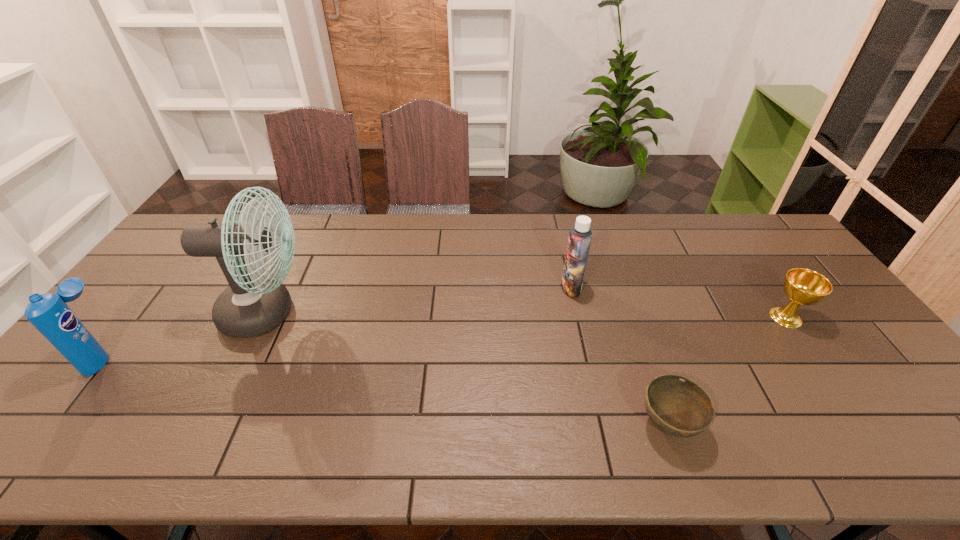
This screenshot has width=960, height=540. Find the location of `vacant area that lies between the fan and the chalice`. vacant area that lies between the fan and the chalice is located at coordinates (526, 315).

This screenshot has width=960, height=540. I want to click on empty space that is in between the third object from left to right and the nearest object, so click(619, 356).

Where is `vacant area that lies between the fourth object from right to left and the left shampoo`? vacant area that lies between the fourth object from right to left and the left shampoo is located at coordinates (185, 334).

Locate an element on the screen. This screenshot has width=960, height=540. vacant point located between the farther shampoo and the rightmost object is located at coordinates (679, 302).

The width and height of the screenshot is (960, 540). Find the location of `vacant space that's between the nearer shampoo and the fourth tallest object`. vacant space that's between the nearer shampoo and the fourth tallest object is located at coordinates (444, 336).

I want to click on vacant area that lies between the leftmost object and the second object from left to right, so click(185, 334).

Find the location of `free space between the second shortest object and the right shampoo`. free space between the second shortest object and the right shampoo is located at coordinates click(x=679, y=302).

Where is `object that is the fourth nearest to the fan`? This screenshot has height=540, width=960. object that is the fourth nearest to the fan is located at coordinates (802, 286).

Identify which object is the third closest to the right shampoo. Please provide its 2D coordinates. Your answer should be formatted as a tuple, i.e. [(x, y)], where the tuple contains the x and y coordinates of a point satisfying the conditions above.

[(252, 305)]

You are a GUI agent. You are given a task and a screenshot of the screen. Output one action in this format:
    pyautogui.click(x=<x>, y=<y>)
    Task: Click on the blank space that satisfies the following two spatial constraints: 1. on the front label of the farther shampoo; 2. on the front side of the nearer shampoo
    
    Given the screenshot: What is the action you would take?
    pyautogui.click(x=587, y=355)